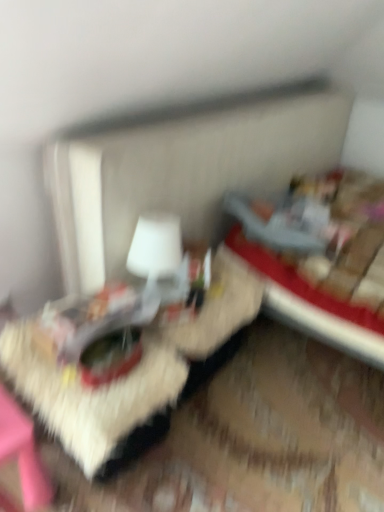
Question: Do you think wooden textured table at center is within white matte table lamp at center, or outside of it?

Choices:
 (A) outside
 (B) inside

Answer: (A)

Question: In terms of width, does wooden textured table at center look wider or thinner when compared to white matte table lamp at center?

Choices:
 (A) thin
 (B) wide

Answer: (B)

Question: Based on their relative distances, which object is farther from the wooden textured table at center?

Choices:
 (A) velvet red bed at right
 (B) white matte table lamp at center

Answer: (A)

Question: Considering the real-world distances, which object is farthest from the velvet red bed at right?

Choices:
 (A) white matte table lamp at center
 (B) wooden textured table at center

Answer: (A)